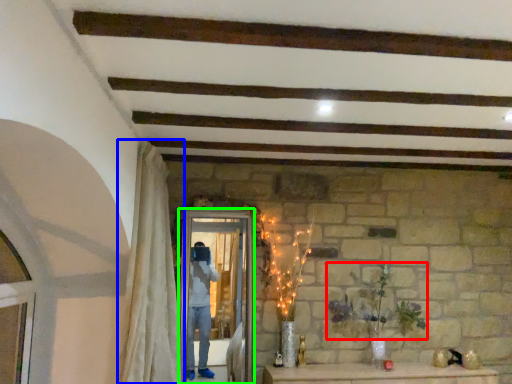
Question: Which is nearer to the plant (highlighted by a red box)? curtain (highlighted by a blue box) or screen door (highlighted by a green box).

Choices:
 (A) curtain
 (B) screen door

Answer: (B)